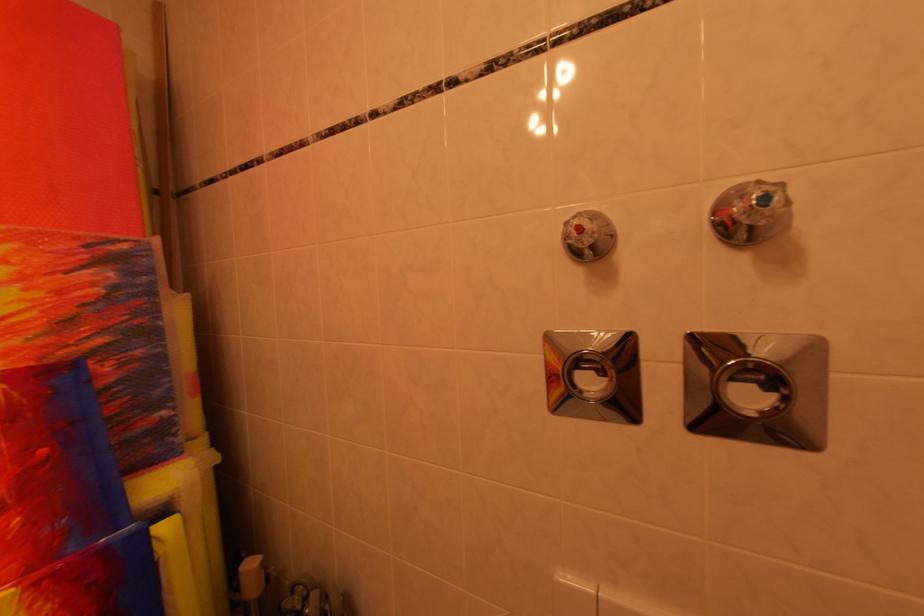
Find where to rotat the wooden roll holder. Please return your answer as a coordinate pair (x, y).

(757, 387)